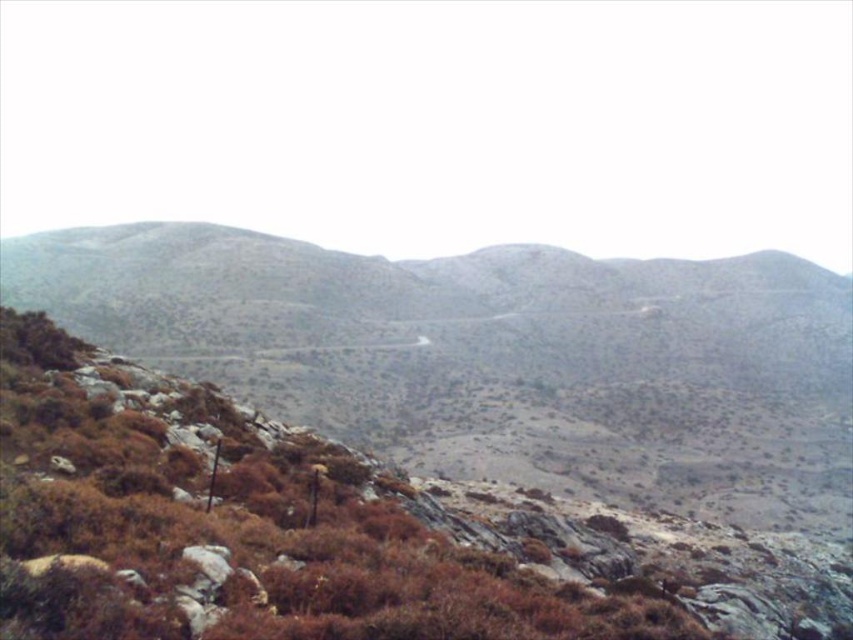
Who is more forward, (798, 442) or (335, 564)?

Result: Point (335, 564) is in front.

Is brown rocky mountain at lower left smaller than brown shrubbery at center?

Actually, brown rocky mountain at lower left might be larger than brown shrubbery at center.

The image size is (853, 640). In order to click on brown rocky mountain at lower left in this screenshot , I will do `click(495, 356)`.